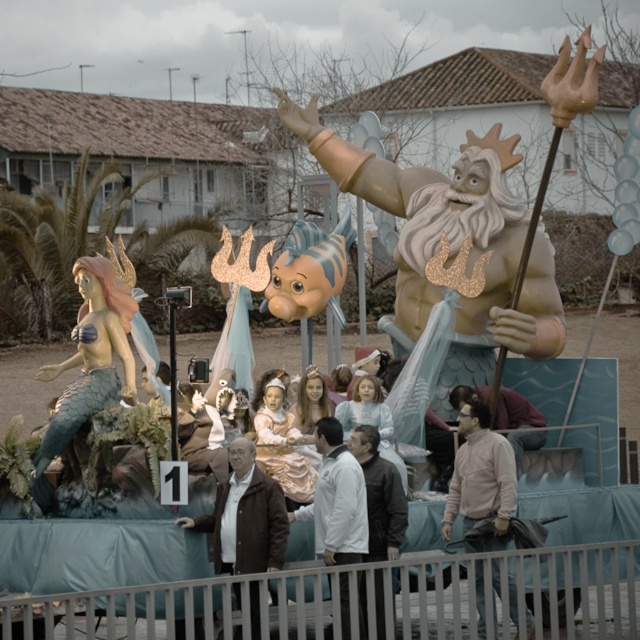
Which is more to the left, gold metallic trident at upper center or pastel pink fabric at center?

pastel pink fabric at center is more to the left.

Can you confirm if gold metallic trident at upper center is thinner than pastel pink fabric at center?

No, gold metallic trident at upper center is not thinner than pastel pink fabric at center.

Who is more forward, (364, 192) or (257, 397)?

Point (257, 397) is in front.

Find the location of a particular element. The image size is (640, 640). gold metallic trident at upper center is located at coordinates (454, 243).

Is point (236, 442) behind point (259, 394)?

No, it is in front of (259, 394).

Between brown leather jacket at center and pastel pink fabric at center, which one appears on the left side from the viewer's perspective?

Positioned to the left is brown leather jacket at center.

At what (x,y) coordinates should I click in order to perform the action: click on brown leather jacket at center. Please return your answer as a coordinate pair (x, y). This screenshot has width=640, height=640. Looking at the image, I should click on (244, 516).

Does point (380, 456) come behind point (259, 419)?

No, it is in front of (259, 419).

This screenshot has height=640, width=640. What are the coordinates of `white matte jacket at center` in the screenshot? It's located at (380, 496).